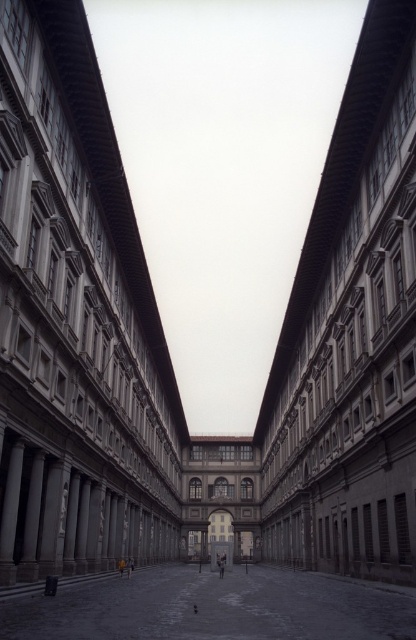
Question: Which object is positioned closest to the smooth stone courtyard at center?

Choices:
 (A) gray stone building at center
 (B) matte gray building at center

Answer: (B)

Question: Can you confirm if matte gray building at center is bigger than smooth stone courtyard at center?

Choices:
 (A) yes
 (B) no

Answer: (B)

Question: Which point appears closest to the camera in this image?

Choices:
 (A) (351, 96)
 (B) (7, 340)
 (C) (366, 628)

Answer: (C)

Question: Can you confirm if gray stone building at center is positioned below smooth stone courtyard at center?

Choices:
 (A) no
 (B) yes

Answer: (A)

Question: Is matte gray building at center below smooth stone courtyard at center?

Choices:
 (A) no
 (B) yes

Answer: (A)

Question: Considering the real-world distances, which object is farthest from the smooth stone courtyard at center?

Choices:
 (A) gray stone building at center
 (B) matte gray building at center

Answer: (A)